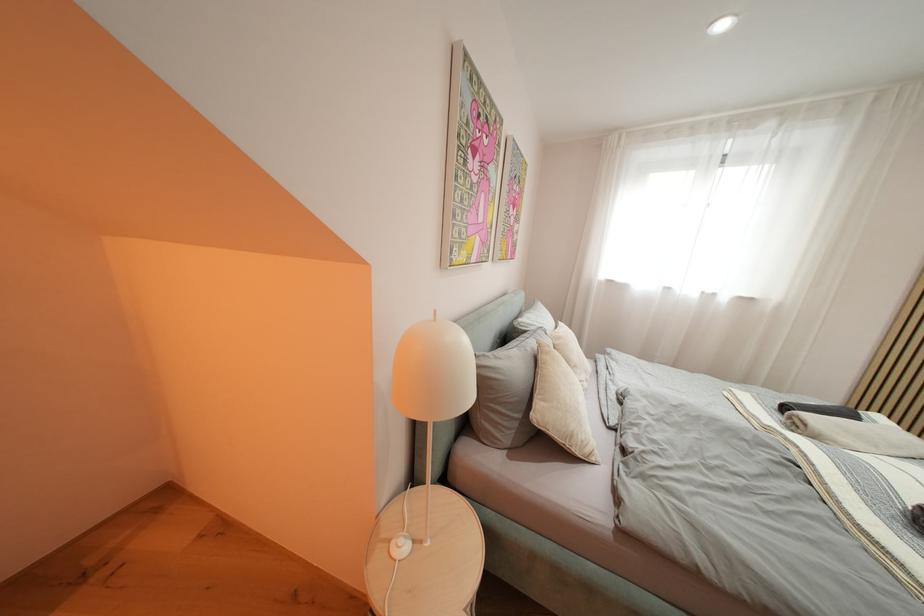
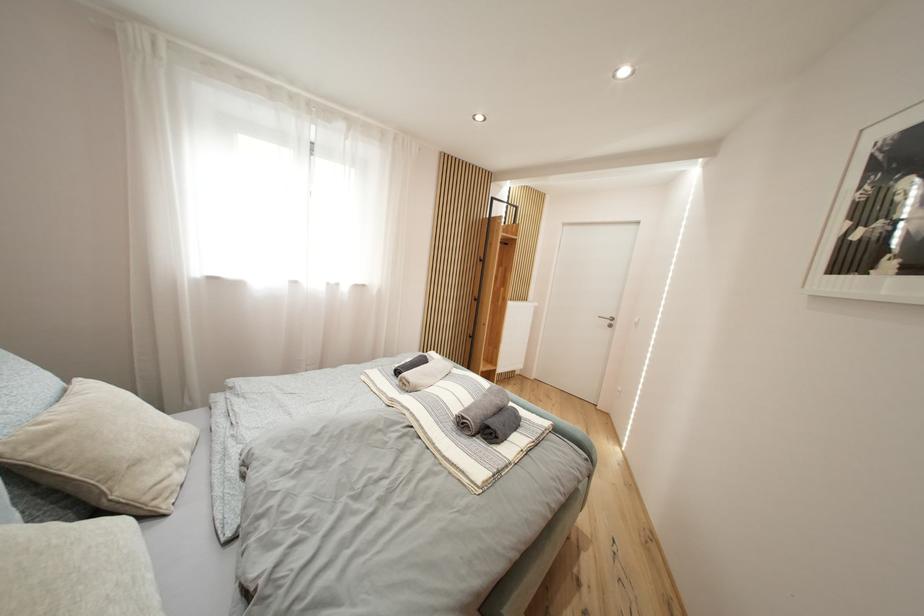
Question: The camera is either moving clockwise (left) or counter-clockwise (right) around the object. The first image is from the beginning of the video and the second image is from the end. Is the camera moving left or right when shooting the video?

Choices:
 (A) Left
 (B) Right

Answer: (A)